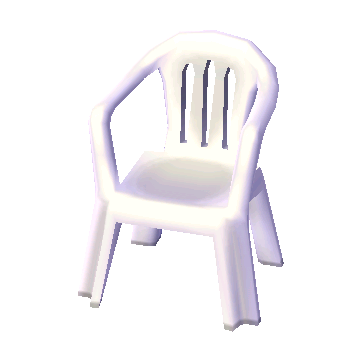
Where is `plastic chair`? The image size is (362, 362). plastic chair is located at coordinates (238, 251).